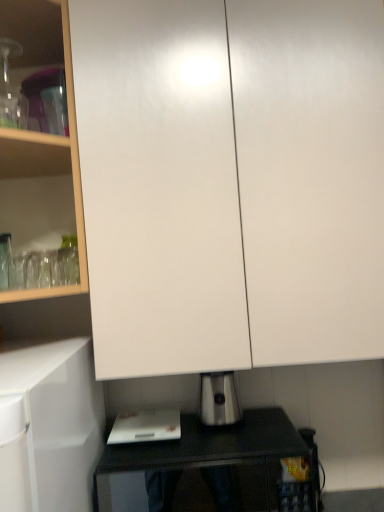
Question: From the image's perspective, does white plastic cutting board at lower center appear higher than black glossy table at lower center?

Choices:
 (A) no
 (B) yes

Answer: (B)

Question: Is white plastic cutting board at lower center positioned behind black glossy table at lower center?

Choices:
 (A) no
 (B) yes

Answer: (B)

Question: Is the position of white plastic cutting board at lower center less distant than that of black glossy table at lower center?

Choices:
 (A) yes
 (B) no

Answer: (B)

Question: From the image's perspective, is white plastic cutting board at lower center under black glossy table at lower center?

Choices:
 (A) yes
 (B) no

Answer: (B)

Question: Is white plastic cutting board at lower center to the left of black glossy table at lower center from the viewer's perspective?

Choices:
 (A) yes
 (B) no

Answer: (A)

Question: From the image's perspective, relative to satin silver toaster at lower center, is white plastic cutting board at lower center above or below?

Choices:
 (A) above
 (B) below

Answer: (B)

Question: In the image, is white plastic cutting board at lower center on the left side or the right side of satin silver toaster at lower center?

Choices:
 (A) left
 (B) right

Answer: (A)

Question: Is white plastic cutting board at lower center spatially inside satin silver toaster at lower center, or outside of it?

Choices:
 (A) inside
 (B) outside

Answer: (B)

Question: Considering their positions, is white plastic cutting board at lower center located in front of or behind satin silver toaster at lower center?

Choices:
 (A) front
 (B) behind

Answer: (A)

Question: From the image's perspective, is black glossy table at lower center located above or below white glossy cabinet at upper left?

Choices:
 (A) above
 (B) below

Answer: (B)

Question: In terms of size, does black glossy table at lower center appear bigger or smaller than white glossy cabinet at upper left?

Choices:
 (A) big
 (B) small

Answer: (B)

Question: Considering the relative positions of black glossy table at lower center and white glossy cabinet at upper left in the image provided, is black glossy table at lower center to the left or to the right of white glossy cabinet at upper left?

Choices:
 (A) left
 (B) right

Answer: (B)

Question: Is black glossy table at lower center wider or thinner than white glossy cabinet at upper left?

Choices:
 (A) wide
 (B) thin

Answer: (B)

Question: From their relative heights in the image, would you say white plastic cutting board at lower center is taller or shorter than white glossy cabinet at upper center?

Choices:
 (A) short
 (B) tall

Answer: (A)

Question: Does point (157, 434) appear closer or farther from the camera than point (193, 88)?

Choices:
 (A) farther
 (B) closer

Answer: (A)